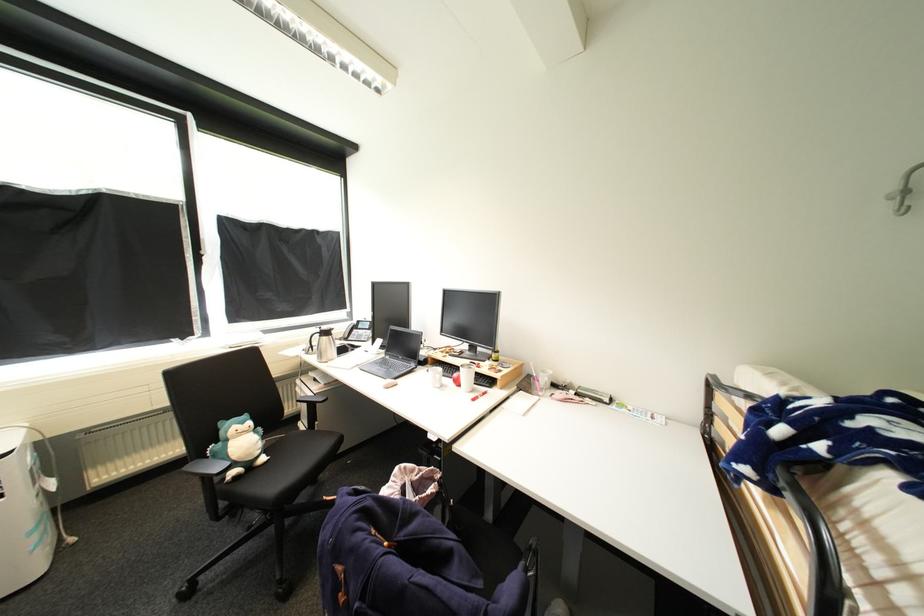
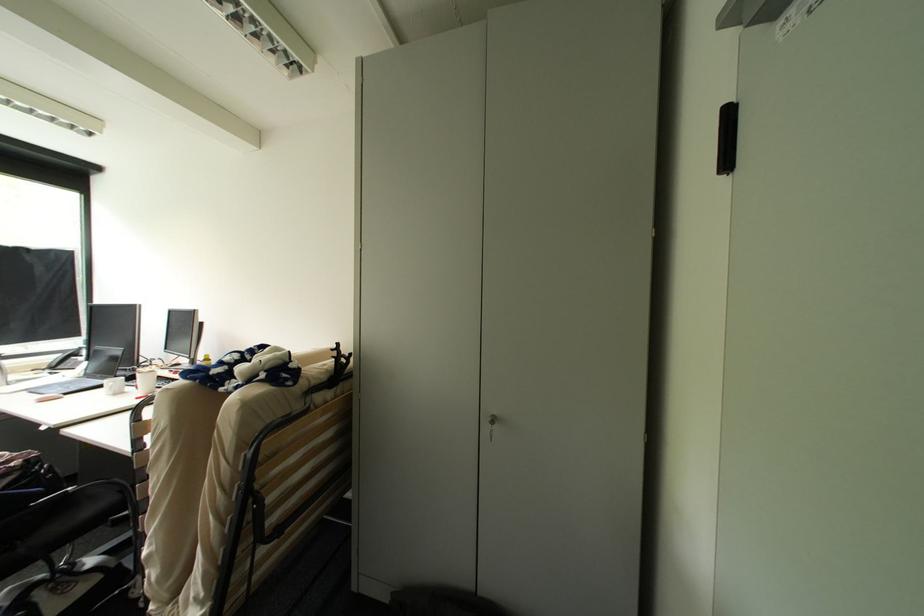
The point at [457,381] is marked in the first image. Where is the corresponding point in the second image?

(141, 387)